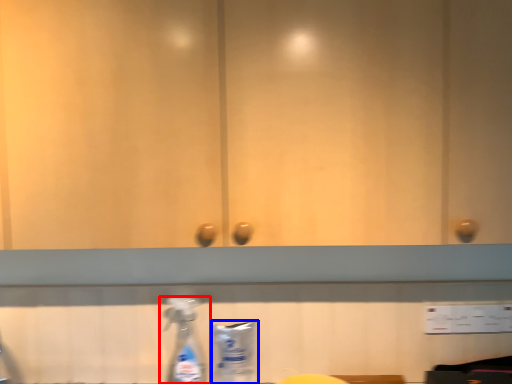
Question: Which object is further to the camera taking this photo, bottle (highlighted by a red box) or cleaning product (highlighted by a blue box)?

Choices:
 (A) bottle
 (B) cleaning product

Answer: (B)